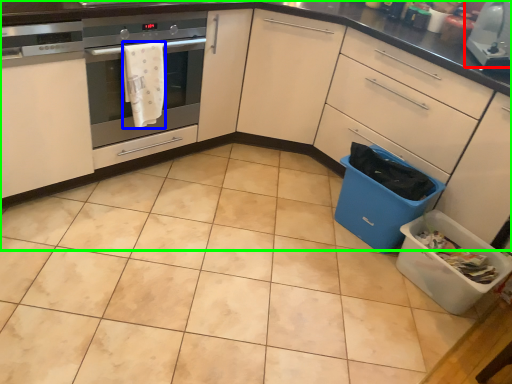
Question: Which object is the farthest from kitchen appliance (highlighted by a red box)? Choose among these: material (highlighted by a blue box) or cabinetry (highlighted by a green box).

Choices:
 (A) material
 (B) cabinetry

Answer: (A)